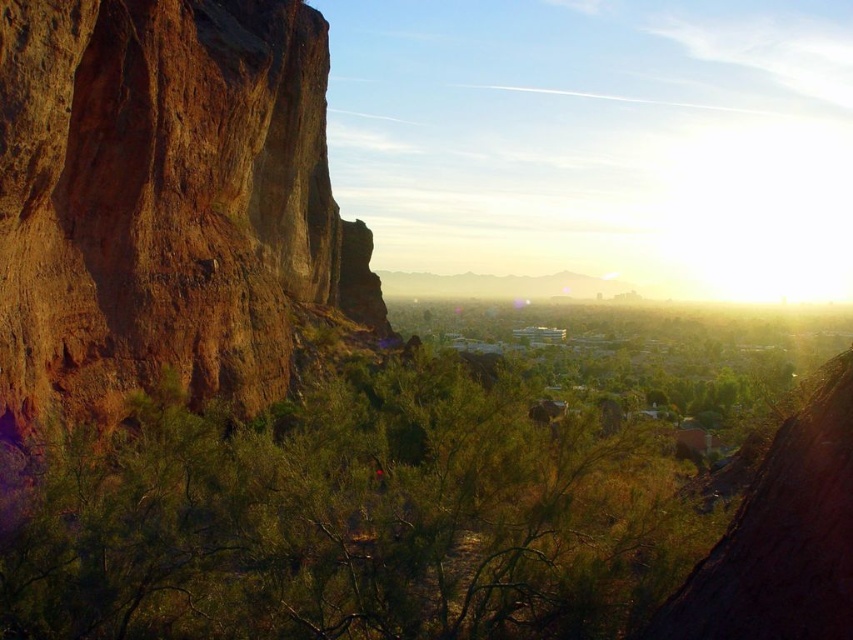
You are standing in the desert and see the green leafy shrub at center and the brown rough rock at left. Which object is nearer to you?

The green leafy shrub at center is closer to the viewer than the brown rough rock at left.

You are a hiker who wants to take a photo of the brown rough rock at left and the green leafy shrub at center. Which object should you focus on first if you want to capture both in the same frame without moving the camera?

The green leafy shrub at center is shorter than the brown rough rock at left, so you should focus on the brown rough rock at left first to ensure both are in focus.

You are standing in the desert landscape and want to take a photo of both point [360,420] and point [97,84] in the scene. Which point should you focus on first to ensure both are in clear view?

You should focus on point [360,420] first because it is closer to the camera than point [97,84], ensuring both points are in focus when using depth of field.